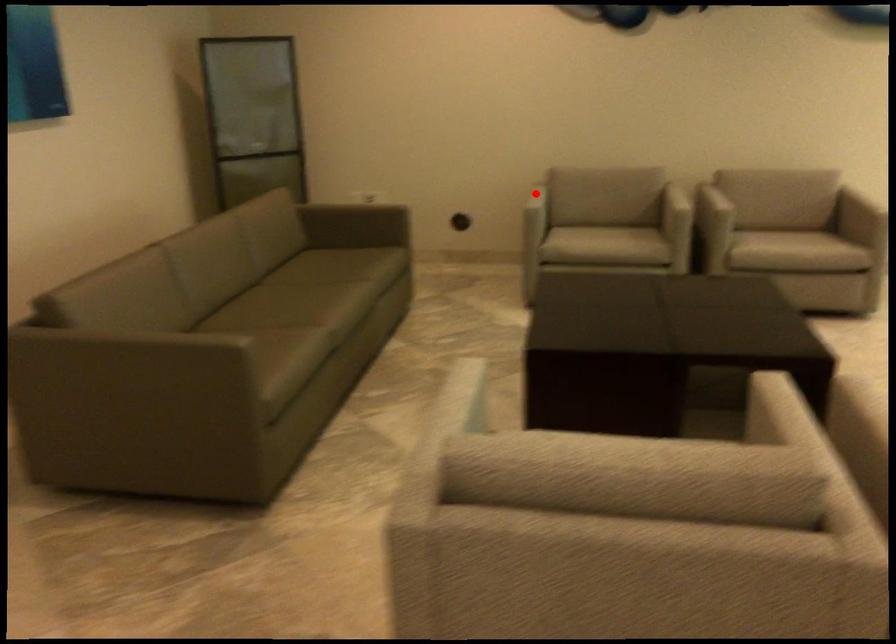
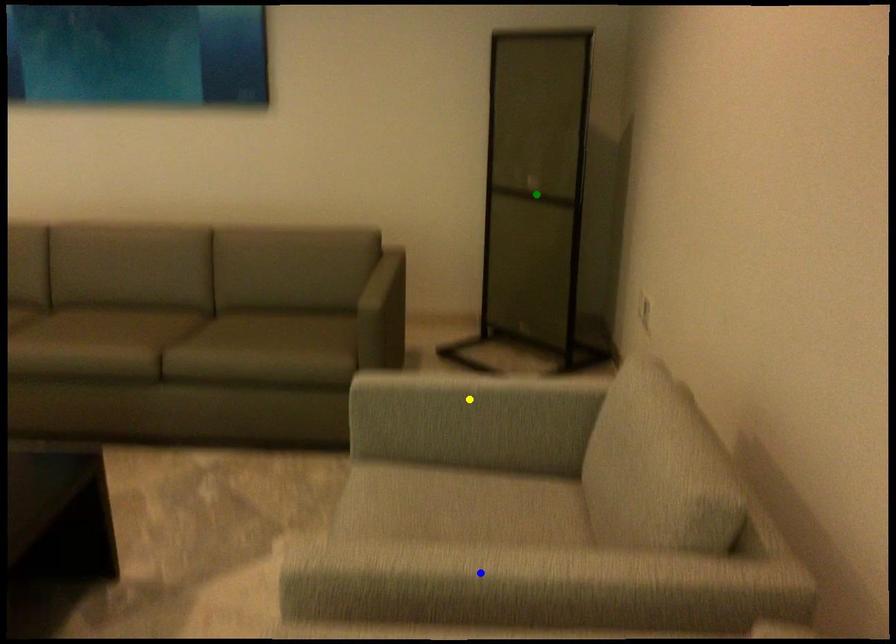
Question: I am providing you with two images of the same scene from different viewpoints. A red point is marked on the first image. You are given multiple points on the second image. Which mark in image 2 goes with the point in image 1?

Choices:
 (A) blue point
 (B) green point
 (C) yellow point

Answer: (C)